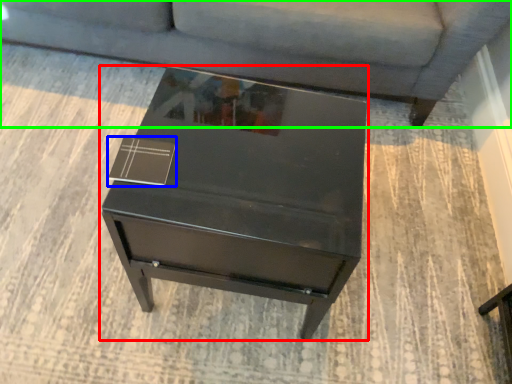
Question: Estimate the real-world distances between objects in this image. Which object is closer to table (highlighted by a red box), square (highlighted by a blue box) or studio couch (highlighted by a green box)?

Choices:
 (A) square
 (B) studio couch

Answer: (A)